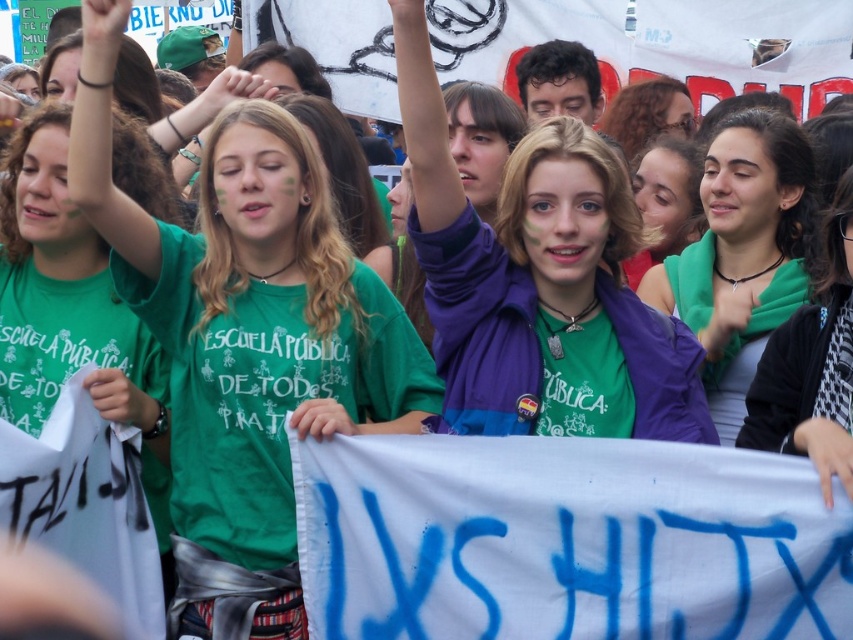
Question: Based on their relative distances, which object is farther from the matte green shirt at center?

Choices:
 (A) green matte shirt at upper right
 (B) blonde hair at upper center

Answer: (B)

Question: Is purple fabric at center above green fabric scarf at center?

Choices:
 (A) yes
 (B) no

Answer: (A)

Question: Which of these objects is positioned farthest from the green matte shirt at upper right?

Choices:
 (A) blonde hair at upper center
 (B) green fabric scarf at center
 (C) matte green shirt at center

Answer: (A)

Question: From the image, what is the correct spatial relationship of green fabric scarf at center in relation to blonde hair at upper center?

Choices:
 (A) above
 (B) below

Answer: (B)

Question: Which point appears farthest from the camera in this image?

Choices:
 (A) (709, 403)
 (B) (682, 88)

Answer: (B)

Question: Where is purple fabric at center located in relation to green fabric scarf at center in the image?

Choices:
 (A) above
 (B) below

Answer: (A)